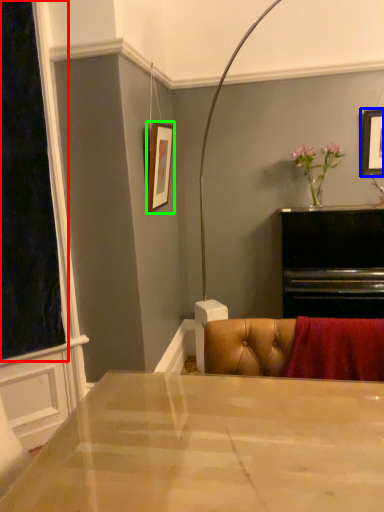
Question: Which is farther away from window screen (highlighted by a red box)? picture frame (highlighted by a blue box) or picture frame (highlighted by a green box)?

Choices:
 (A) picture frame
 (B) picture frame

Answer: (A)